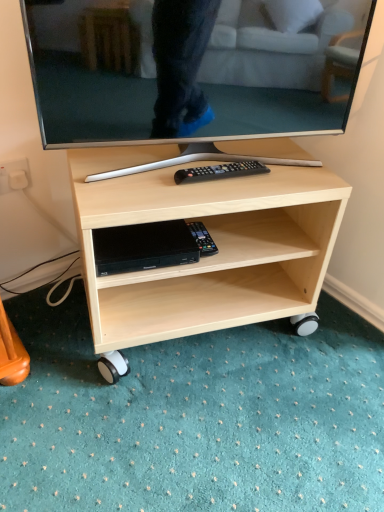
Question: In the image, is matte black tv at center positioned in front of or behind black plastic remote control at center?

Choices:
 (A) behind
 (B) front

Answer: (B)

Question: Looking at their shapes, would you say matte black tv at center is wider or thinner than black plastic remote control at center?

Choices:
 (A) wide
 (B) thin

Answer: (B)

Question: Which object is positioned closest to the matte black tv at center?

Choices:
 (A) black plastic remote at center
 (B) black plastic remote control at center
 (C) light wood/texture tv stand at center
 (D) black plastic dvd player at lower center

Answer: (C)

Question: Estimate the real-world distances between objects in this image. Which object is farther from the light wood/texture tv stand at center?

Choices:
 (A) black plastic remote at center
 (B) black plastic dvd player at lower center
 (C) matte black tv at center
 (D) black plastic remote control at center

Answer: (A)